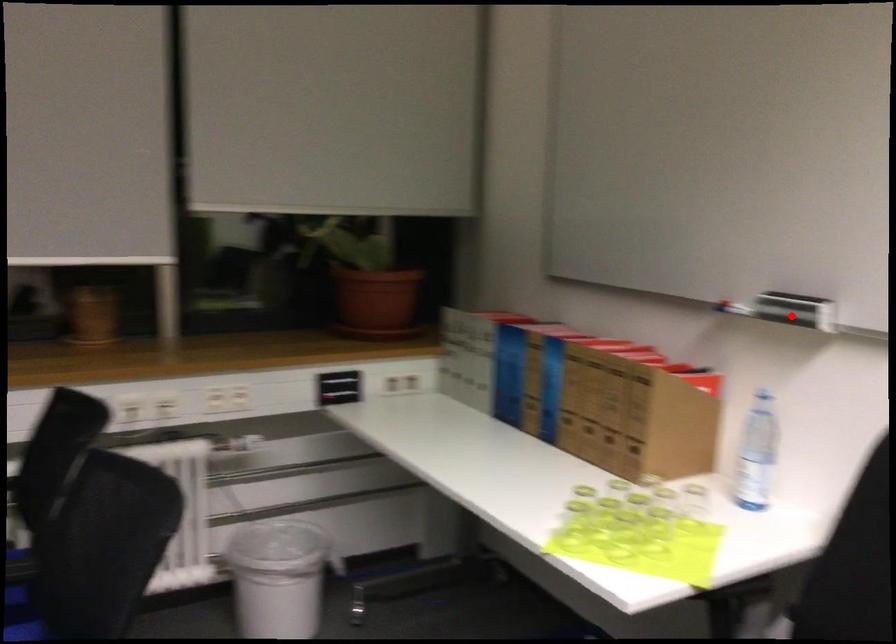
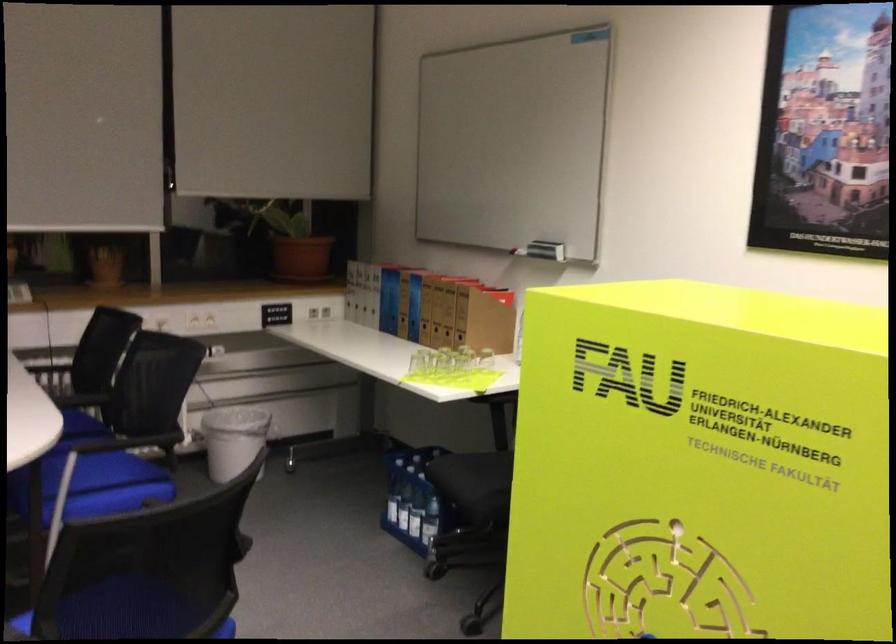
Question: I am providing you with two images of the same scene from different viewpoints. Given a red point in image1, look at the same physical point in image2. Is it:

Choices:
 (A) Closer to the viewpoint
 (B) Farther from the viewpoint

Answer: (B)